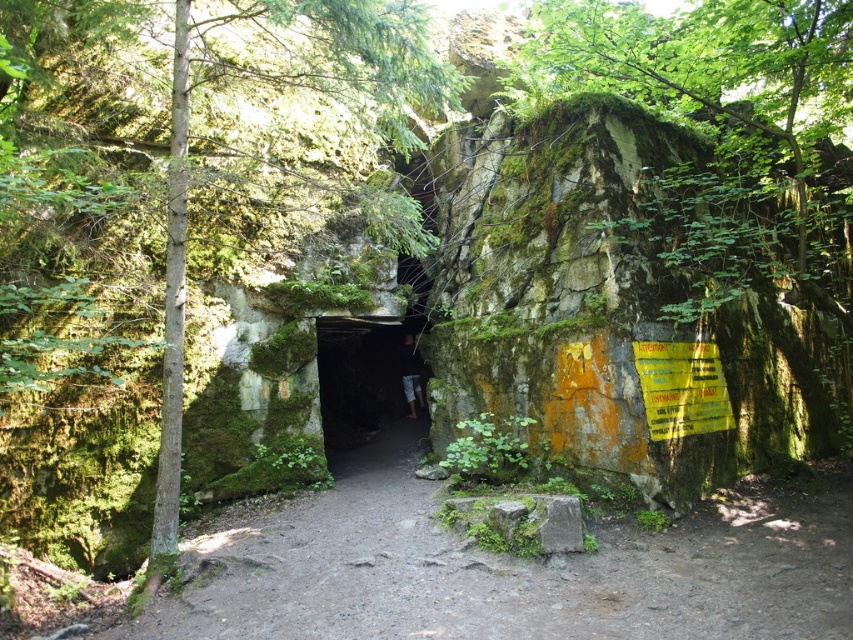
You are a hiker exploring a forest and come across the green mossy cave at center and the dark fabric pants at center. Which object is closer to you as you stand at the entrance?

The green mossy cave at center is closer to you because it is in front of the dark fabric pants at center.

You are an explorer deciding between two paths in a forest. You see a green mossy tree at center and a green mossy cave at center. Which path would you choose if you want to go through the narrower opening?

You should choose the green mossy tree at center because it is thinner than the green mossy cave at center, making it the narrower opening.